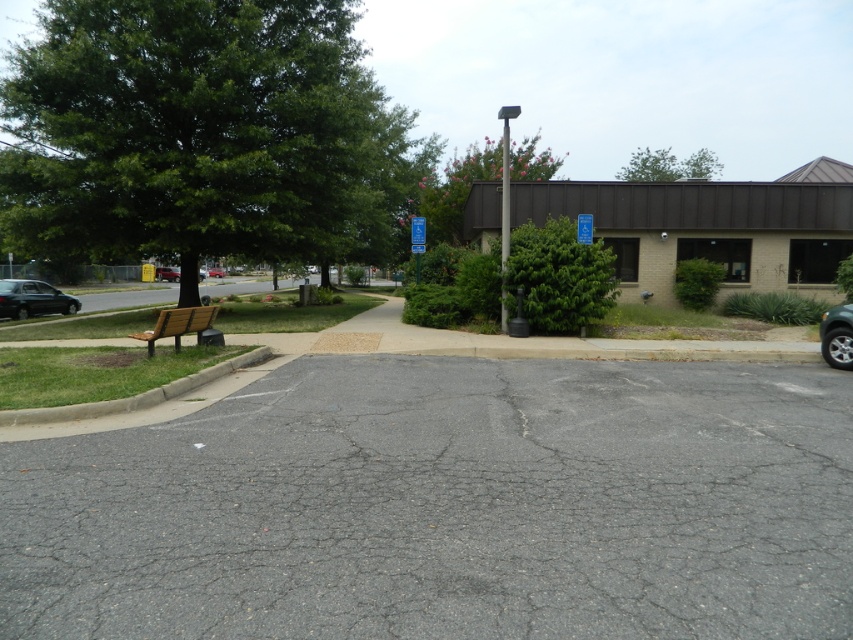
You are standing in the outdoor area looking towards the building. Which of the two green leafy trees, the green leafy tree at upper left or the green leafy tree at upper center, is positioned more to your left?

The green leafy tree at upper left is positioned more to the left compared to the green leafy tree at upper center.

You are standing at the entrance of the building and looking towards the trees. Which tree, the green leafy tree at upper left or the green leafy tree at upper center, appears taller from your vantage point?

The green leafy tree at upper center appears taller because it has a greater height compared to the green leafy tree at upper left.

Looking at this image, you are standing at the point with coordinates point (212, 323) and want to walk to the building with a dark brown roof. Is the point point (671, 177) between you and the building?

Point (671, 177) is behind point (212, 323), so it is not between you and the building with a dark brown roof. You can walk towards the building without the point blocking your path.